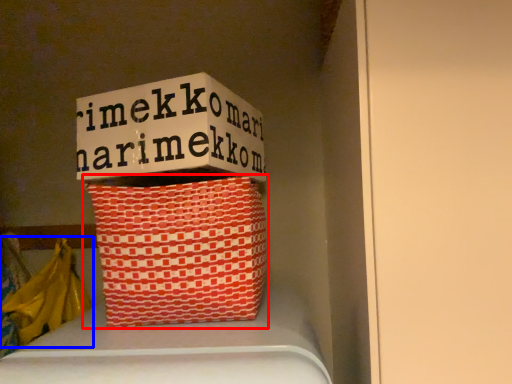
Question: Among these objects, which one is farthest to the camera, basket (highlighted by a red box) or material (highlighted by a blue box)?

Choices:
 (A) basket
 (B) material

Answer: (B)